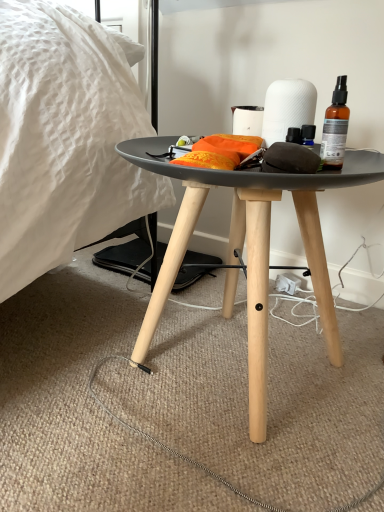
Locate an element on the screen. The image size is (384, 512). vacant space situated on the left part of black matte side table at center is located at coordinates (64, 349).